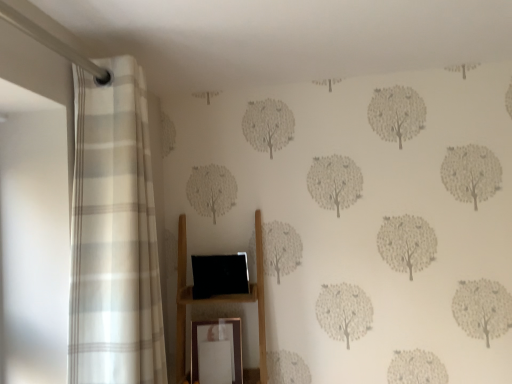
Question: In terms of width, does wooden shelf at center look wider or thinner when compared to gold metallic picture frame at lower center?

Choices:
 (A) wide
 (B) thin

Answer: (A)

Question: Looking at the image, does wooden shelf at center seem bigger or smaller compared to gold metallic picture frame at lower center?

Choices:
 (A) big
 (B) small

Answer: (A)

Question: Which object is the closest to the white striped curtain at left?

Choices:
 (A) gold metallic picture frame at lower center
 (B) wooden shelf at center

Answer: (B)

Question: Which object is the closest to the gold metallic picture frame at lower center?

Choices:
 (A) wooden shelf at center
 (B) white striped curtain at left

Answer: (A)